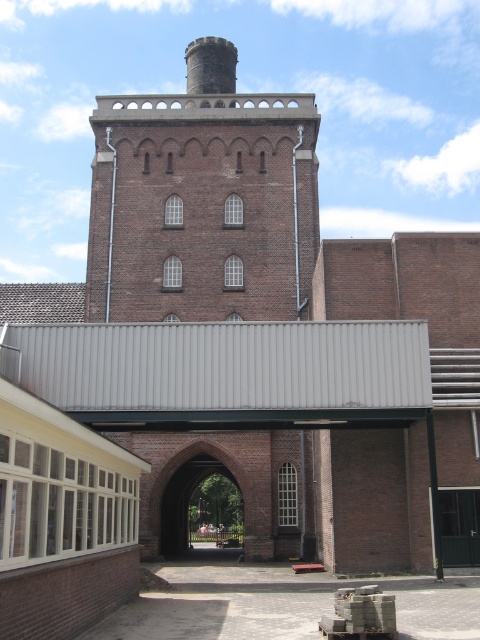
Question: Which object appears farthest from the camera in this image?

Choices:
 (A) brown brick tower at upper center
 (B) smooth gray chimney at upper center

Answer: (B)

Question: Which object is closer to the camera taking this photo?

Choices:
 (A) smooth gray chimney at upper center
 (B) brown brick tower at upper center

Answer: (B)

Question: Can you confirm if brown brick tower at upper center is positioned below smooth gray chimney at upper center?

Choices:
 (A) no
 (B) yes

Answer: (B)

Question: Can you confirm if brown brick tower at upper center is bigger than smooth gray chimney at upper center?

Choices:
 (A) no
 (B) yes

Answer: (A)

Question: Which point is closer to the camera?

Choices:
 (A) (217, 80)
 (B) (151, 316)

Answer: (B)

Question: Can you confirm if brown brick tower at upper center is thinner than smooth gray chimney at upper center?

Choices:
 (A) yes
 (B) no

Answer: (B)